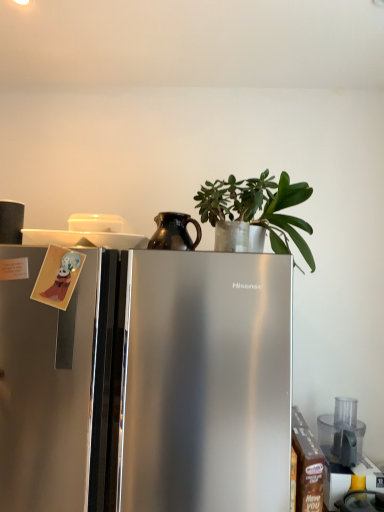
Question: Can you see transparent plastic food processor at lower right, the third appliance when ordered from left to right, touching green matte plant at upper center?

Choices:
 (A) yes
 (B) no

Answer: (B)

Question: Does transparent plastic food processor at lower right, marked as the 1th appliance in a bottom-to-top arrangement, have a lesser width compared to green matte plant at upper center?

Choices:
 (A) no
 (B) yes

Answer: (A)

Question: Considering the relative positions of transparent plastic food processor at lower right, which is the 1th appliance from right to left, and green matte plant at upper center in the image provided, is transparent plastic food processor at lower right, which is the 1th appliance from right to left, behind green matte plant at upper center?

Choices:
 (A) yes
 (B) no

Answer: (A)

Question: Does transparent plastic food processor at lower right, marked as the third appliance in a top-to-bottom arrangement, appear on the right side of green matte plant at upper center?

Choices:
 (A) yes
 (B) no

Answer: (A)

Question: From the image's perspective, is transparent plastic food processor at lower right, arranged as the first appliance when viewed from the back, on top of green matte plant at upper center?

Choices:
 (A) no
 (B) yes

Answer: (A)

Question: Does transparent plastic food processor at lower right, marked as the 1th appliance in a bottom-to-top arrangement, have a smaller size compared to green matte plant at upper center?

Choices:
 (A) no
 (B) yes

Answer: (B)

Question: Does transparent plastic food processor at lower right, arranged as the first appliance when viewed from the back, have a lesser width compared to matte black coffee cup at upper left, which is the 2th appliance in back-to-front order?

Choices:
 (A) yes
 (B) no

Answer: (B)

Question: Is the position of transparent plastic food processor at lower right, the third appliance when ordered from left to right, more distant than that of matte black coffee cup at upper left, the 1th appliance viewed from the top?

Choices:
 (A) no
 (B) yes

Answer: (B)

Question: Is matte black coffee cup at upper left, placed as the first appliance when sorted from left to right, at the back of transparent plastic food processor at lower right, the third appliance when ordered from left to right?

Choices:
 (A) yes
 (B) no

Answer: (B)

Question: Would you say transparent plastic food processor at lower right, the third appliance viewed from the front, is outside matte black coffee cup at upper left, acting as the second appliance starting from the front?

Choices:
 (A) no
 (B) yes

Answer: (B)

Question: Does transparent plastic food processor at lower right, the third appliance viewed from the front, have a smaller size compared to matte black coffee cup at upper left, which is the 2th appliance in back-to-front order?

Choices:
 (A) no
 (B) yes

Answer: (A)

Question: Considering the relative sizes of transparent plastic food processor at lower right, marked as the third appliance in a top-to-bottom arrangement, and matte black coffee cup at upper left, which appears as the third appliance when viewed from the right, in the image provided, is transparent plastic food processor at lower right, marked as the third appliance in a top-to-bottom arrangement, taller than matte black coffee cup at upper left, which appears as the third appliance when viewed from the right,?

Choices:
 (A) yes
 (B) no

Answer: (A)

Question: Would you say satin silver refrigerator at center is outside shiny brown pitcher at center, acting as the 3th appliance starting from the back?

Choices:
 (A) no
 (B) yes

Answer: (B)